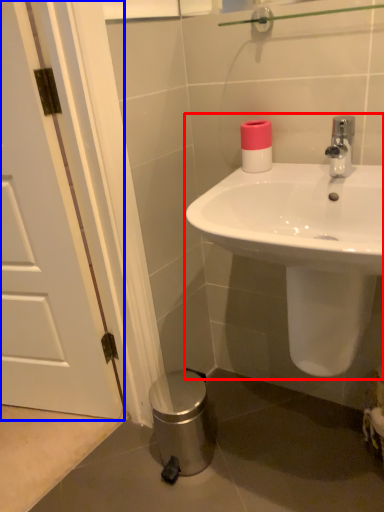
Question: Which of the following is the closest to the observer, sink (highlighted by a red box) or door (highlighted by a blue box)?

Choices:
 (A) sink
 (B) door

Answer: (A)